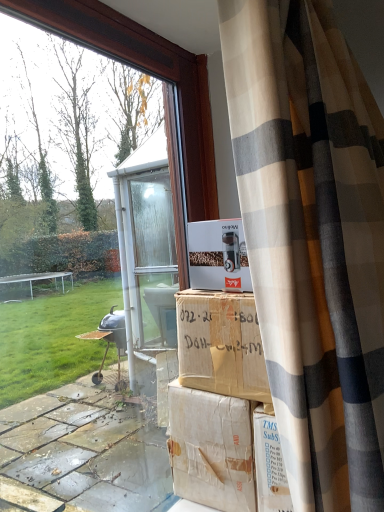
Question: In terms of height, does white cardboard box at center, arranged as the 1th cardboard box when viewed from the top, look taller or shorter compared to brown cardboard box at center, the 1th cardboard box in the bottom-to-top sequence?

Choices:
 (A) short
 (B) tall

Answer: (A)

Question: Based on their positions, is white cardboard box at center, which is the 2th cardboard box from bottom to top, located to the left or right of brown cardboard box at center, the 1th cardboard box in the bottom-to-top sequence?

Choices:
 (A) left
 (B) right

Answer: (B)

Question: Considering the real-world distances, which object is farthest from the white cardboard box at center, which is the 2th cardboard box from bottom to top?

Choices:
 (A) transparent glass window at center
 (B) brown cardboard box at center, the 1th cardboard box in the bottom-to-top sequence

Answer: (A)

Question: Which is farther from the transparent glass window at center?

Choices:
 (A) brown cardboard box at center, the 1th cardboard box in the bottom-to-top sequence
 (B) white cardboard box at center, which is the 2th cardboard box from bottom to top

Answer: (A)